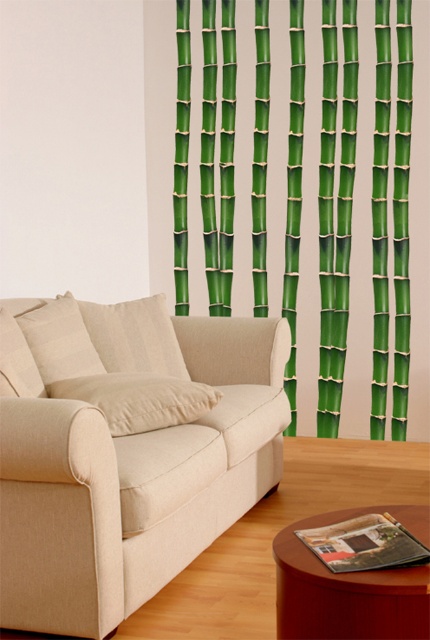
Is beige fabric couch at left below green bamboo at upper right?

Yes, beige fabric couch at left is below green bamboo at upper right.

Is beige fabric couch at left further to camera compared to green bamboo at upper right?

No, it is in front of green bamboo at upper right.

Between point (138, 529) and point (178, 186), which one is positioned behind?

The point (178, 186) is more distant.

This screenshot has height=640, width=430. What are the coordinates of `beige fabric couch at left` in the screenshot? It's located at (125, 451).

Is beige fabric couch at left to the left of wooden round table at lower right from the viewer's perspective?

Indeed, beige fabric couch at left is positioned on the left side of wooden round table at lower right.

Who is more distant from viewer, (149, 483) or (328, 628)?

The point (149, 483) is more distant.

Is point (141, 477) farther from viewer compared to point (279, 625)?

Yes, point (141, 477) is behind point (279, 625).

This screenshot has height=640, width=430. I want to click on beige fabric couch at left, so click(x=125, y=451).

Who is shorter, green bamboo at upper right or wooden round table at lower right?

Standing shorter between the two is wooden round table at lower right.

Can you confirm if green bamboo at upper right is wider than wooden round table at lower right?

Yes.

Which is in front, point (300, 13) or point (375, 595)?

Point (375, 595) is more forward.

You are a GUI agent. You are given a task and a screenshot of the screen. Output one action in this format:
    pyautogui.click(x=<x>, y=<y>)
    Task: Click on the green bamboo at upper right
    The height and width of the screenshot is (640, 430).
    Given the screenshot: What is the action you would take?
    pyautogui.click(x=335, y=205)